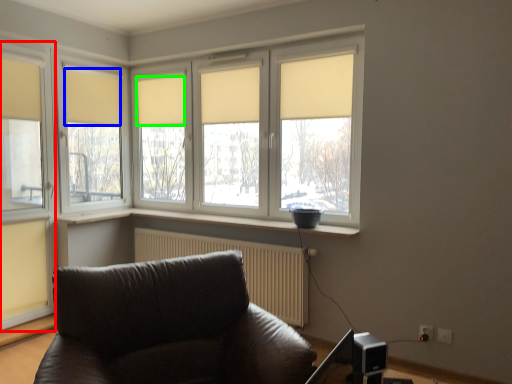
Question: Which is farther away from window (highlighted by a red box)? curtain (highlighted by a blue box) or curtain (highlighted by a green box)?

Choices:
 (A) curtain
 (B) curtain

Answer: (B)